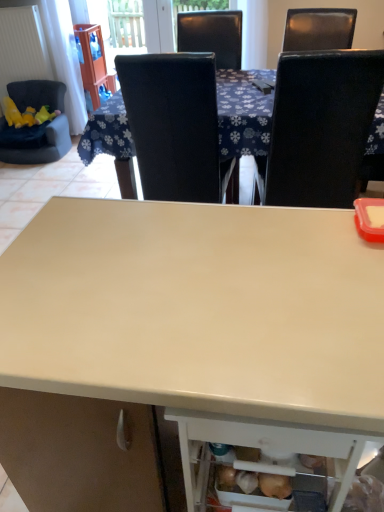
Question: Should I look upward or downward to see matte white desk at center?

Choices:
 (A) up
 (B) down

Answer: (B)

Question: From a real-world perspective, is black leather chair at upper center, the 2th chair positioned from the left, positioned over black leather chair at upper right, the 1th chair when ordered from right to left, based on gravity?

Choices:
 (A) no
 (B) yes

Answer: (A)

Question: Is black leather chair at upper center, which ranks as the 2th chair in right-to-left order, shorter than black leather chair at upper right, the 3th chair positioned from the left?

Choices:
 (A) yes
 (B) no

Answer: (A)

Question: Does black leather chair at upper center, the 2th chair positioned from the left, contain black leather chair at upper right, the 1th chair when ordered from right to left?

Choices:
 (A) yes
 (B) no

Answer: (B)

Question: Can you confirm if black leather chair at upper center, the 2th chair positioned from the left, is wider than black leather chair at upper right, the 3th chair positioned from the left?

Choices:
 (A) yes
 (B) no

Answer: (A)

Question: From a real-world perspective, is black leather chair at upper center, which ranks as the 2th chair in right-to-left order, below black leather chair at upper right, the 1th chair when ordered from right to left?

Choices:
 (A) yes
 (B) no

Answer: (A)

Question: Is black leather chair at upper center, which ranks as the 2th chair in right-to-left order, bigger than black leather chair at upper right, the 3th chair positioned from the left?

Choices:
 (A) no
 (B) yes

Answer: (A)

Question: Is white glossy table at center at the left side of velvet dark blue chair at left, positioned as the first chair in left-to-right order?

Choices:
 (A) no
 (B) yes

Answer: (A)

Question: From the image's perspective, is white glossy table at center below velvet dark blue chair at left, positioned as the first chair in left-to-right order?

Choices:
 (A) yes
 (B) no

Answer: (A)

Question: Is white glossy table at center facing towards velvet dark blue chair at left, arranged as the 3th chair when viewed from the right?

Choices:
 (A) no
 (B) yes

Answer: (B)

Question: Is white glossy table at center in contact with velvet dark blue chair at left, arranged as the 3th chair when viewed from the right?

Choices:
 (A) no
 (B) yes

Answer: (A)

Question: Considering the relative sizes of white glossy table at center and velvet dark blue chair at left, arranged as the 3th chair when viewed from the right, in the image provided, is white glossy table at center taller than velvet dark blue chair at left, arranged as the 3th chair when viewed from the right,?

Choices:
 (A) yes
 (B) no

Answer: (A)

Question: Considering the relative sizes of white glossy table at center and velvet dark blue chair at left, positioned as the first chair in left-to-right order, in the image provided, is white glossy table at center shorter than velvet dark blue chair at left, positioned as the first chair in left-to-right order,?

Choices:
 (A) yes
 (B) no

Answer: (B)

Question: From a real-world perspective, is black leather chair at upper right, the 1th chair when ordered from right to left, physically above white glossy table at center?

Choices:
 (A) no
 (B) yes

Answer: (B)